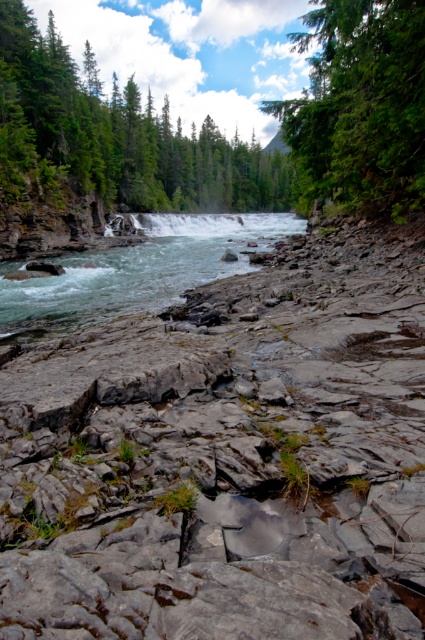
Which is more to the right, green matte tree at upper center or green matte tree at upper right?

From the viewer's perspective, green matte tree at upper right appears more on the right side.

Can you confirm if green matte tree at upper center is thinner than green matte tree at upper right?

Indeed, green matte tree at upper center has a lesser width compared to green matte tree at upper right.

Does point (79, 106) lie behind point (418, 76)?

Yes, point (79, 106) is farther from viewer.

I want to click on green matte tree at upper center, so click(116, 134).

Is gray rock at center smaller than white frothy water at center?

Correct, gray rock at center occupies less space than white frothy water at center.

Where is `gray rock at center`? Image resolution: width=425 pixels, height=640 pixels. gray rock at center is located at coordinates (226, 458).

This screenshot has height=640, width=425. Find the location of `gray rock at center`. gray rock at center is located at coordinates (226, 458).

Measure the distance from gray rock at center to green matte tree at upper center.

They are 46.59 meters apart.

Image resolution: width=425 pixels, height=640 pixels. What do you see at coordinates (226, 458) in the screenshot? I see `gray rock at center` at bounding box center [226, 458].

The height and width of the screenshot is (640, 425). I want to click on gray rock at center, so click(x=226, y=458).